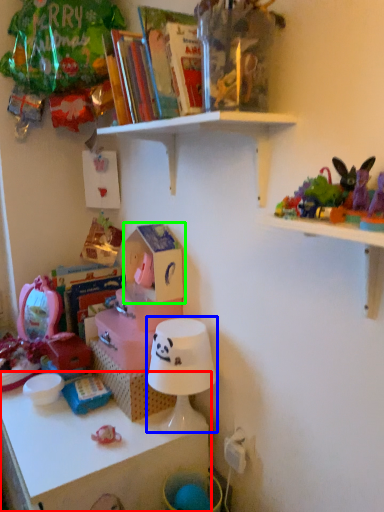
Question: Which is farther away from shelf (highlighted by a red box)? lamp (highlighted by a blue box) or storage box (highlighted by a green box)?

Choices:
 (A) lamp
 (B) storage box

Answer: (B)